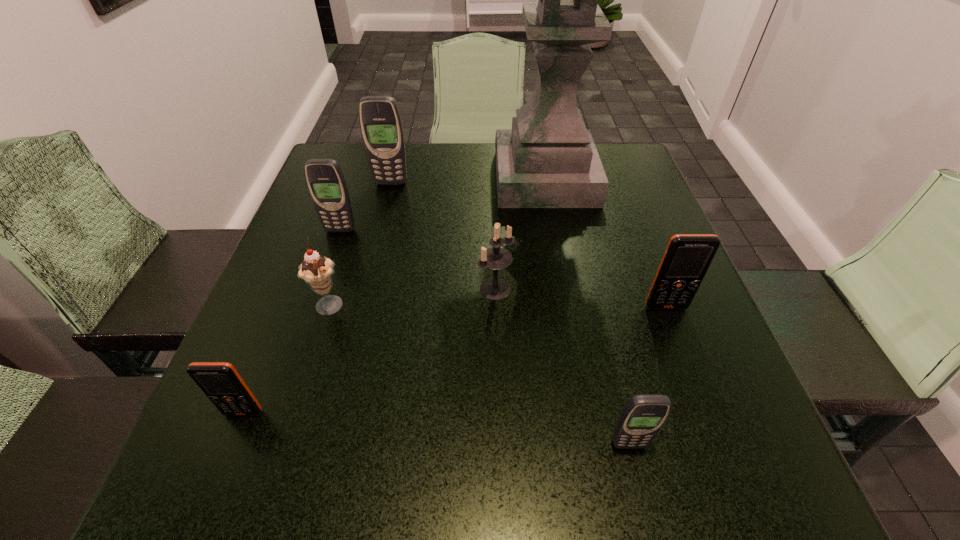
This screenshot has width=960, height=540. In order to click on vacant area that lies between the rightmost gray cellular telephone and the icecream in this screenshot , I will do `click(479, 376)`.

What are the coordinates of `unoccupied area between the icecream and the candle holder` in the screenshot? It's located at (412, 298).

You are a GUI agent. You are given a task and a screenshot of the screen. Output one action in this format:
    pyautogui.click(x=<x>, y=<y>)
    Task: Click on the vacant area between the nearest gray cellular telephone and the second farthest gray cellular telephone
    
    Given the screenshot: What is the action you would take?
    (x=484, y=338)

The height and width of the screenshot is (540, 960). I want to click on vacant area between the sculpture and the smaller orange cellular telephone, so click(395, 295).

I want to click on free spot between the biggest gray cellular telephone and the second farthest gray cellular telephone, so click(366, 207).

This screenshot has width=960, height=540. In order to click on free space that is in between the seventh farthest object and the candle holder in this screenshot , I will do `click(370, 350)`.

The image size is (960, 540). I want to click on vacant space in between the icecream and the second cellular telephone from right to left, so click(x=479, y=376).

This screenshot has width=960, height=540. What are the coordinates of `vacant area between the seventh shortest object and the gray sculpture` in the screenshot? It's located at (468, 181).

Where is `the fourth closest object relative to the seventh shortest object`? The height and width of the screenshot is (540, 960). the fourth closest object relative to the seventh shortest object is located at coordinates (316, 270).

In order to click on object that is the fifth closest one to the sculpture in this screenshot , I will do `click(316, 270)`.